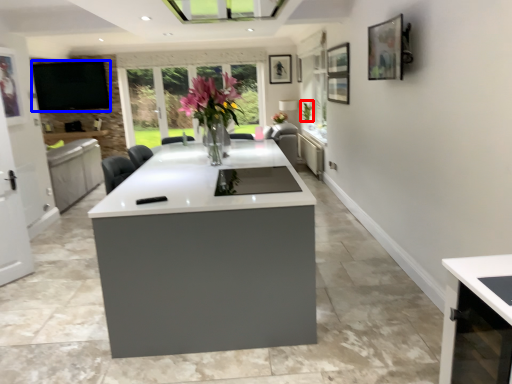
Question: Among these objects, which one is nearest to the camera, plant (highlighted by a red box) or window screen (highlighted by a blue box)?

Choices:
 (A) plant
 (B) window screen

Answer: (A)